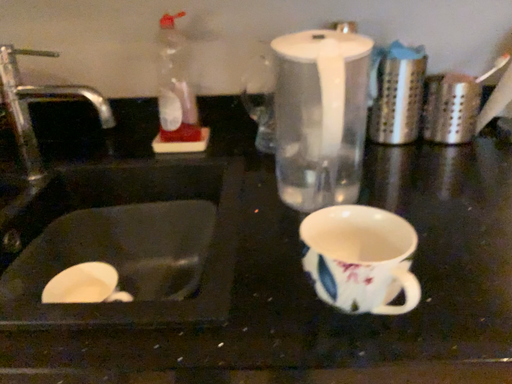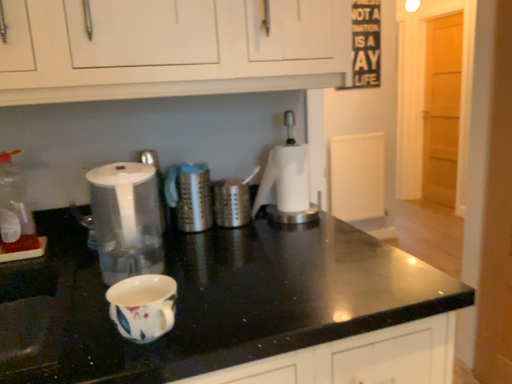
Question: Which way did the camera rotate in the video?

Choices:
 (A) rotated right
 (B) rotated left

Answer: (A)